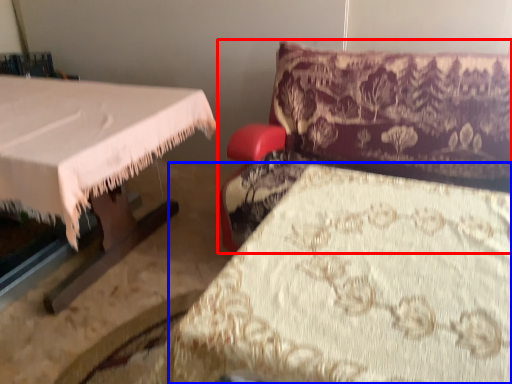
Question: Which object appears farthest to the camera in this image, furniture (highlighted by a red box) or sheet (highlighted by a blue box)?

Choices:
 (A) furniture
 (B) sheet

Answer: (A)